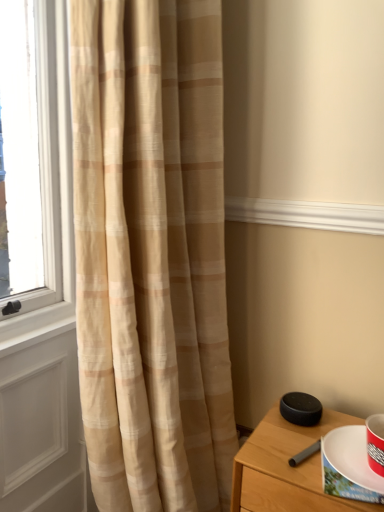
Question: From a real-world perspective, is black matte speaker at lower right under beige textured curtain at left?

Choices:
 (A) yes
 (B) no

Answer: (A)

Question: Can you confirm if black matte speaker at lower right is taller than beige textured curtain at left?

Choices:
 (A) yes
 (B) no

Answer: (B)

Question: Is black matte speaker at lower right to the left of beige textured curtain at left from the viewer's perspective?

Choices:
 (A) yes
 (B) no

Answer: (B)

Question: Is the surface of black matte speaker at lower right in direct contact with beige textured curtain at left?

Choices:
 (A) no
 (B) yes

Answer: (A)

Question: Can you confirm if black matte speaker at lower right is shorter than beige textured curtain at left?

Choices:
 (A) yes
 (B) no

Answer: (A)

Question: From a real-world perspective, is translucent beige curtain at left physically located above or below beige textured curtain at left?

Choices:
 (A) below
 (B) above

Answer: (A)

Question: From the image's perspective, is translucent beige curtain at left above or below beige textured curtain at left?

Choices:
 (A) below
 (B) above

Answer: (A)

Question: Considering the relative positions of translucent beige curtain at left and beige textured curtain at left in the image provided, is translucent beige curtain at left to the left or to the right of beige textured curtain at left?

Choices:
 (A) left
 (B) right

Answer: (A)

Question: From their relative heights in the image, would you say translucent beige curtain at left is taller or shorter than beige textured curtain at left?

Choices:
 (A) tall
 (B) short

Answer: (B)

Question: Considering the positions of beige textured curtain at left and white paper plate at lower right in the image, is beige textured curtain at left bigger or smaller than white paper plate at lower right?

Choices:
 (A) small
 (B) big

Answer: (B)

Question: Considering their positions, is beige textured curtain at left located in front of or behind white paper plate at lower right?

Choices:
 (A) front
 (B) behind

Answer: (A)

Question: From a real-world perspective, is beige textured curtain at left positioned above or below white paper plate at lower right?

Choices:
 (A) below
 (B) above

Answer: (B)

Question: Based on their positions, is beige textured curtain at left located to the left or right of white paper plate at lower right?

Choices:
 (A) right
 (B) left

Answer: (B)

Question: From a real-world perspective, is black matte speaker at lower right positioned above or below white paper plate at lower right?

Choices:
 (A) above
 (B) below

Answer: (B)

Question: Considering the positions of point (253, 499) and point (360, 461), is point (253, 499) closer or farther from the camera than point (360, 461)?

Choices:
 (A) closer
 (B) farther

Answer: (B)